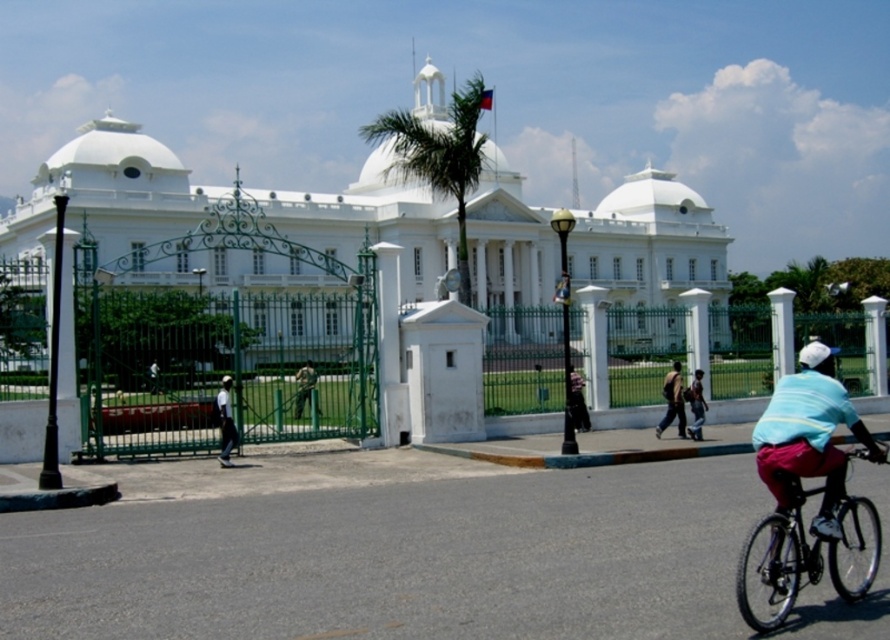
Based on the photo, you are standing at the entrance of the white glossy building at center and want to reach the flagpole flying a red flag at its center. Which direction should you move relative to the building?

Since the flagpole is at the center of the white glossy building at center, you are already at the correct position to reach it. No movement is needed.